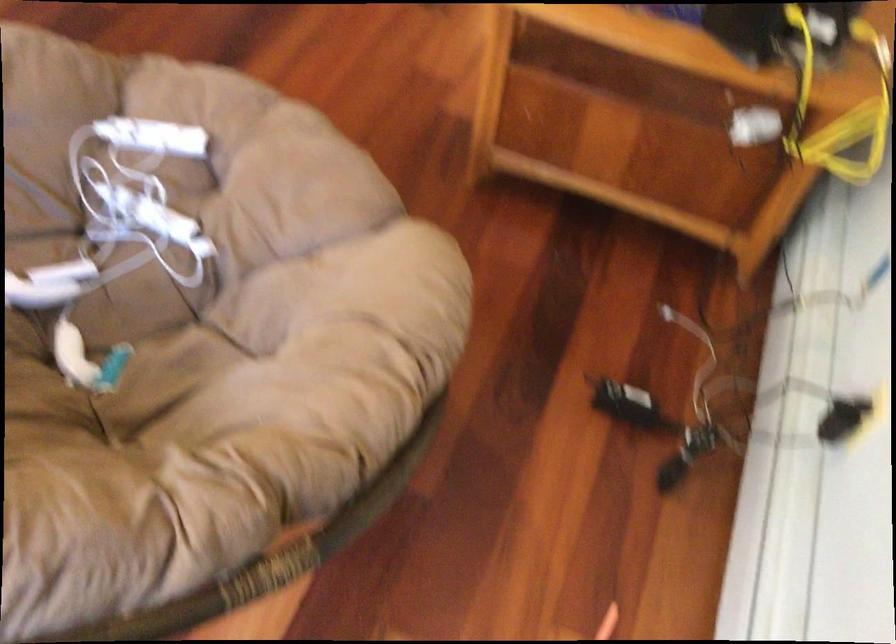
Find where to grip the white nunchuk controller. Please return your answer as a coordinate pair (x, y).

(152, 137)